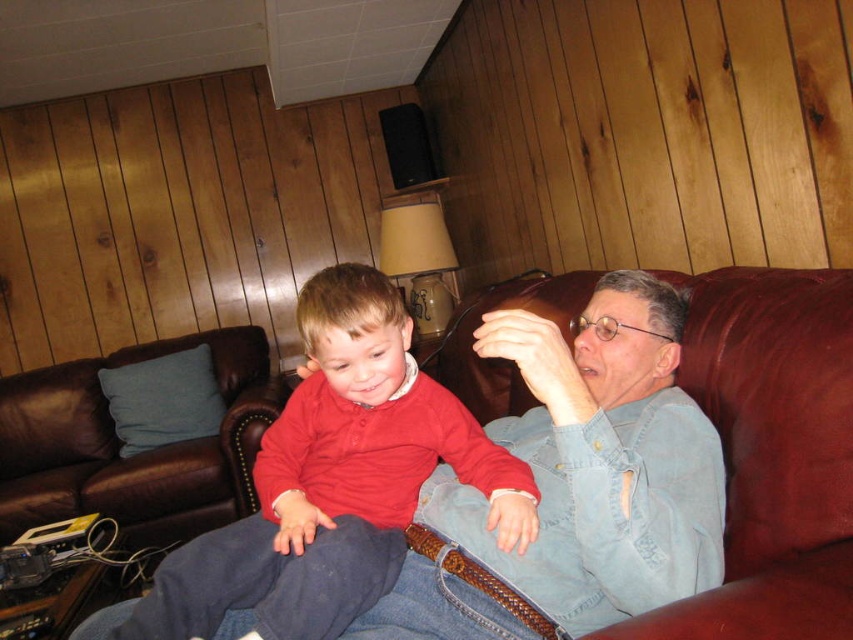
Between red matte shirt at center and matte red sweater at center, which one is positioned lower?

matte red sweater at center

Is red matte shirt at center behind matte red sweater at center?

No, it is in front of matte red sweater at center.

Identify the location of red matte shirt at center. (335, 481).

You are a GUI agent. You are given a task and a screenshot of the screen. Output one action in this format:
    pyautogui.click(x=<x>, y=<y>)
    Task: Click on the red matte shirt at center
    Image resolution: width=853 pixels, height=640 pixels.
    Given the screenshot: What is the action you would take?
    pyautogui.click(x=335, y=481)